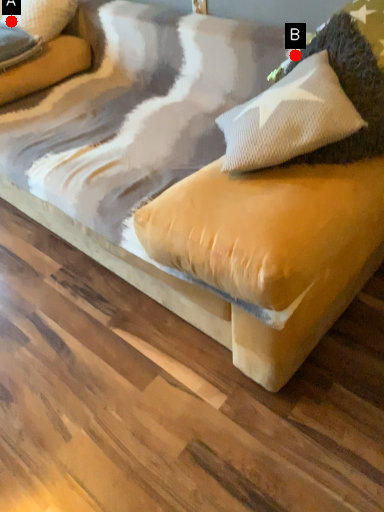
Question: Two points are circled on the image, labeled by A and B beside each circle. Which point is closer to the camera taking this photo?

Choices:
 (A) A is closer
 (B) B is closer

Answer: (B)